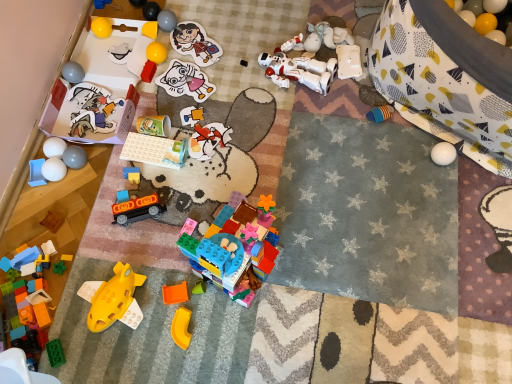
At what (x,y) coordinates should I click in order to perform the action: click on free space between yellow rubber ball at upper left, the fifteenth toy viewed from the left, and yellow matte plastic arch at center, which appears as the 21th toy when viewed from the left. Please return your answer as a coordinate pair (x, y). Looking at the image, I should click on (168, 177).